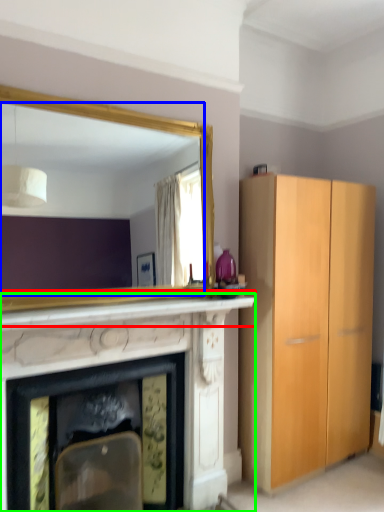
Question: Which is farther away from mantle (highlighted by a red box)? mirror (highlighted by a blue box) or fireplace (highlighted by a green box)?

Choices:
 (A) mirror
 (B) fireplace

Answer: (A)